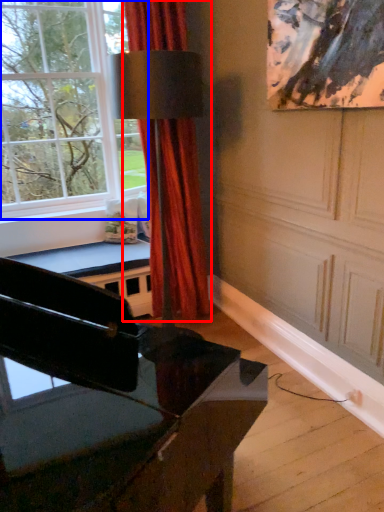
Question: Which object is closer to the camera taking this photo, curtain (highlighted by a red box) or window (highlighted by a blue box)?

Choices:
 (A) curtain
 (B) window

Answer: (B)